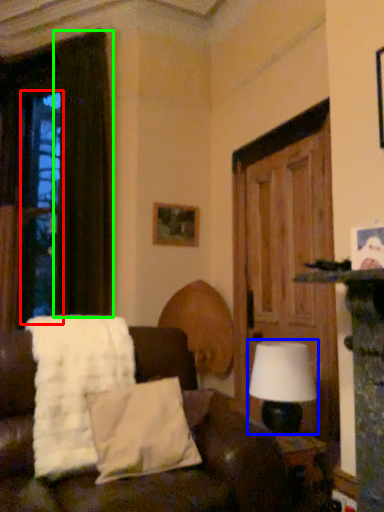
Question: Considering the real-world distances, which object is farthest from window (highlighted by a red box)? table lamp (highlighted by a blue box) or curtain (highlighted by a green box)?

Choices:
 (A) table lamp
 (B) curtain

Answer: (A)